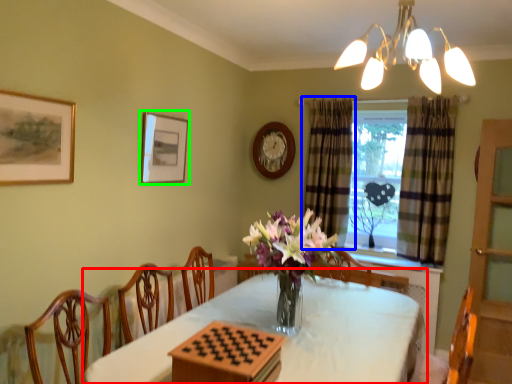
Question: Based on their relative distances, which object is nearer to table (highlighted by a red box)? Choose from curtain (highlighted by a blue box) and picture frame (highlighted by a green box).

Choices:
 (A) curtain
 (B) picture frame

Answer: (B)